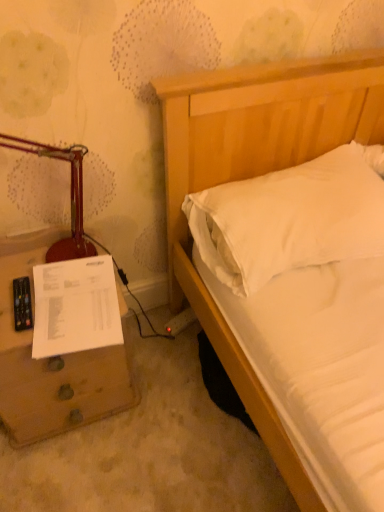
Image resolution: width=384 pixels, height=512 pixels. Identify the location of free space above brown wooden nightstand at lower left (from a real-world perspective). (50, 294).